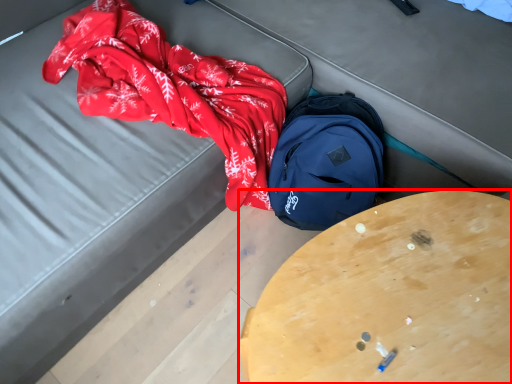
Question: From the image's perspective, what is the correct spatial relationship of table (annotated by the red box) in relation to backpack?

Choices:
 (A) above
 (B) below

Answer: (B)